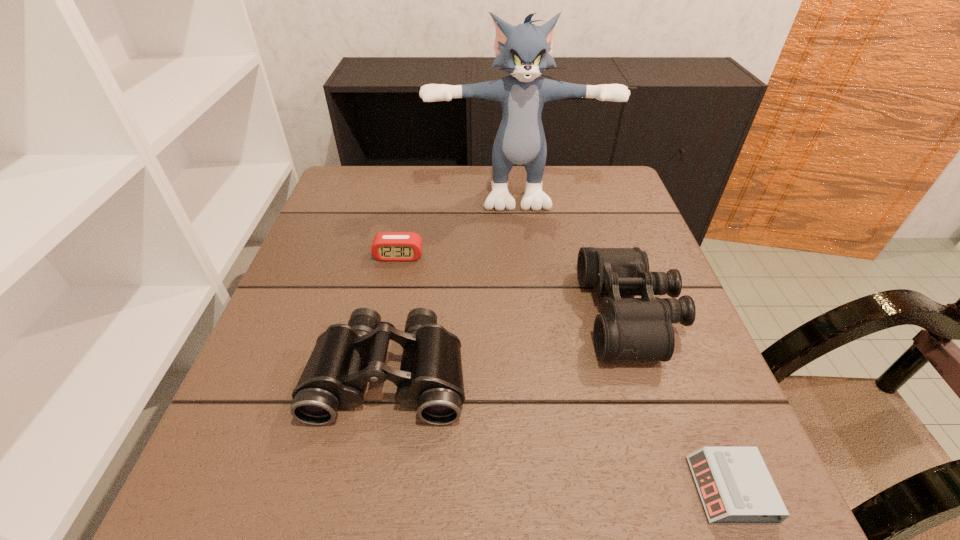
Identify the location of alarm clock at the right edge. The image size is (960, 540). (735, 486).

Image resolution: width=960 pixels, height=540 pixels. In order to click on object located in the far right corner section of the desktop in this screenshot , I will do `click(525, 51)`.

You are a GUI agent. You are given a task and a screenshot of the screen. Output one action in this format:
    pyautogui.click(x=<x>, y=<y>)
    Task: Click on the object situated at the near right corner
    The image size is (960, 540).
    Given the screenshot: What is the action you would take?
    pyautogui.click(x=735, y=486)

The image size is (960, 540). Identify the location of vacant region at the far edge of the desktop. (417, 170).

Identify the location of vacant area at the near edge. (331, 470).

Identify the location of free space at the left edge of the desktop. (244, 397).

Where is `vacant region at the right edge of the desktop`? This screenshot has height=540, width=960. vacant region at the right edge of the desktop is located at coordinates (596, 228).

In the image, there is a desktop. Where is `vacant space at the near left corner`? Image resolution: width=960 pixels, height=540 pixels. vacant space at the near left corner is located at coordinates (271, 498).

In the image, there is a desktop. Identify the location of free space at the far right corner. Image resolution: width=960 pixels, height=540 pixels. (613, 197).

The image size is (960, 540). I want to click on vacant space that is in between the right binoculars and the cat, so click(573, 251).